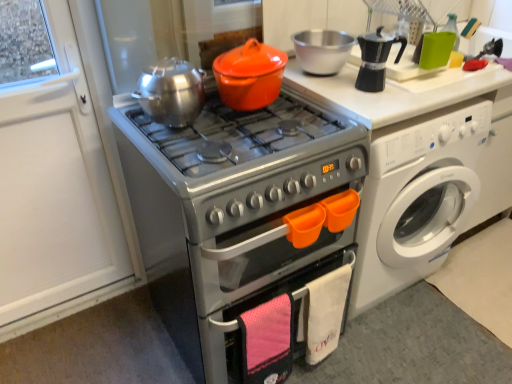
Question: Can you see white glossy washing machine at right touching brushed metal tea pot at upper center?

Choices:
 (A) yes
 (B) no

Answer: (B)

Question: Is white glossy washing machine at right bigger than brushed metal tea pot at upper center?

Choices:
 (A) yes
 (B) no

Answer: (A)

Question: Is white glossy washing machine at right thinner than brushed metal tea pot at upper center?

Choices:
 (A) no
 (B) yes

Answer: (A)

Question: Does white glossy washing machine at right appear on the right side of brushed metal tea pot at upper center?

Choices:
 (A) yes
 (B) no

Answer: (A)

Question: Is white glossy washing machine at right completely or partially outside of brushed metal tea pot at upper center?

Choices:
 (A) yes
 (B) no

Answer: (A)

Question: Is point (449, 210) closer or farther from the camera than point (279, 77)?

Choices:
 (A) closer
 (B) farther

Answer: (B)

Question: From the image's perspective, is white glossy washing machine at right positioned above or below orange matte crock pot at center?

Choices:
 (A) below
 (B) above

Answer: (A)

Question: Is white glossy washing machine at right wider or thinner than orange matte crock pot at center?

Choices:
 (A) wide
 (B) thin

Answer: (A)

Question: Is white glossy washing machine at right bigger or smaller than orange matte crock pot at center?

Choices:
 (A) big
 (B) small

Answer: (A)

Question: Looking at their shapes, would you say orange matte crock pot at center is wider or thinner than silver metallic oven at center?

Choices:
 (A) wide
 (B) thin

Answer: (B)

Question: From the image's perspective, is orange matte crock pot at center located above or below silver metallic oven at center?

Choices:
 (A) above
 (B) below

Answer: (A)

Question: Based on their positions, is orange matte crock pot at center located to the left or right of silver metallic oven at center?

Choices:
 (A) right
 (B) left

Answer: (A)

Question: Considering the positions of orange matte crock pot at center and silver metallic oven at center in the image, is orange matte crock pot at center taller or shorter than silver metallic oven at center?

Choices:
 (A) short
 (B) tall

Answer: (A)

Question: In terms of size, does silver metallic oven at center appear bigger or smaller than white glossy washing machine at right?

Choices:
 (A) small
 (B) big

Answer: (B)

Question: Relative to white glossy washing machine at right, is silver metallic oven at center in front or behind?

Choices:
 (A) front
 (B) behind

Answer: (A)